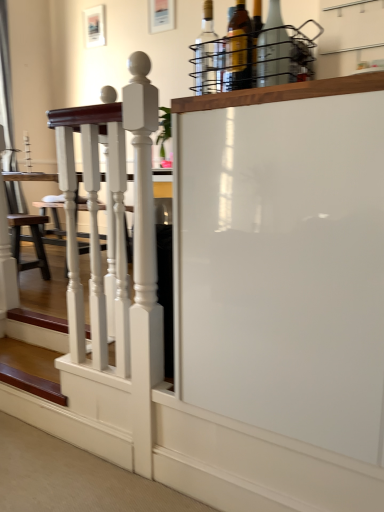
Question: From a real-world perspective, relative to translucent glass bottle at upper center, the second bottle when ordered from left to right, is clear glass bottle at upper center, the fifth bottle in the left-to-right sequence, vertically above or below?

Choices:
 (A) below
 (B) above

Answer: (A)

Question: Is clear glass bottle at upper center, which is the first bottle in right-to-left order, bigger or smaller than translucent glass bottle at upper center, the second bottle when ordered from left to right?

Choices:
 (A) big
 (B) small

Answer: (A)

Question: Which of these objects is positioned closest to the clear glass bottle at upper center, which is the first bottle in right-to-left order?

Choices:
 (A) white glossy wooden railing at left
 (B) wooden stairs at lower left
 (C) translucent glass bottle at upper center, which appears as the 4th bottle when viewed from the right
 (D) brown leather stool at lower left
 (E) translucent glass bottle at upper center, which appears as the 3th bottle when viewed from the left

Answer: (E)

Question: Which is farther from the white glossy screen door at center?

Choices:
 (A) brown leather stool at lower left
 (B) translucent glass bottle at upper center, which appears as the 3th bottle when viewed from the right
 (C) clear glass bottle at upper center, the fifth bottle in the left-to-right sequence
 (D) white glossy wooden railing at left
 (E) wooden stairs at lower left

Answer: (A)